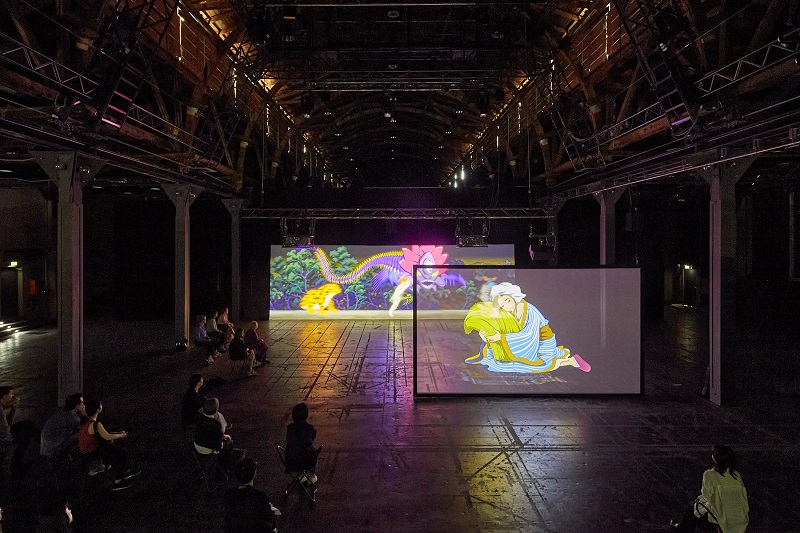
Image resolution: width=800 pixels, height=533 pixels. In order to click on screen in this screenshot , I will do `click(382, 312)`, `click(460, 379)`.